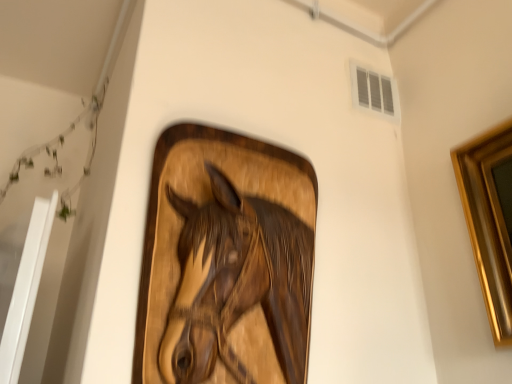
Question: Can you confirm if wooden horse at center is smaller than white plastic vent at upper right?

Choices:
 (A) yes
 (B) no

Answer: (B)

Question: Is wooden horse at center placed right next to white plastic vent at upper right?

Choices:
 (A) no
 (B) yes

Answer: (A)

Question: Is wooden horse at center in front of white plastic vent at upper right?

Choices:
 (A) yes
 (B) no

Answer: (A)

Question: Is wooden horse at center to the right of white plastic vent at upper right from the viewer's perspective?

Choices:
 (A) yes
 (B) no

Answer: (B)

Question: Is wooden horse at center positioned behind white plastic vent at upper right?

Choices:
 (A) no
 (B) yes

Answer: (A)

Question: From the image's perspective, is wooden horse at center above white plastic vent at upper right?

Choices:
 (A) no
 (B) yes

Answer: (A)

Question: Are white plastic vent at upper right and wooden horse at center far apart?

Choices:
 (A) no
 (B) yes

Answer: (A)

Question: Considering the relative positions of white plastic vent at upper right and wooden horse at center in the image provided, is white plastic vent at upper right to the left of wooden horse at center from the viewer's perspective?

Choices:
 (A) no
 (B) yes

Answer: (A)

Question: Considering the relative sizes of white plastic vent at upper right and wooden horse at center in the image provided, is white plastic vent at upper right shorter than wooden horse at center?

Choices:
 (A) yes
 (B) no

Answer: (A)

Question: Is white plastic vent at upper right in front of wooden horse at center?

Choices:
 (A) no
 (B) yes

Answer: (A)

Question: Is white plastic vent at upper right smaller than wooden horse at center?

Choices:
 (A) no
 (B) yes

Answer: (B)

Question: Is white plastic vent at upper right to the right of wooden horse at center from the viewer's perspective?

Choices:
 (A) yes
 (B) no

Answer: (A)

Question: Is wooden horse at center taller or shorter than white plastic vent at upper right?

Choices:
 (A) short
 (B) tall

Answer: (B)